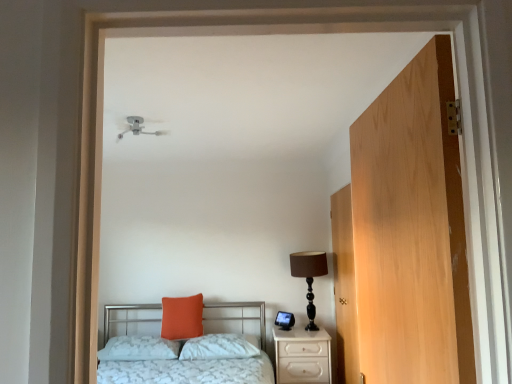
At what (x,y) coordinates should I click in order to perform the action: click on orange matte pillow at center, which is the first pillow in right-to-left order. Please return your answer as a coordinate pair (x, y). Looking at the image, I should click on (219, 347).

What is the approximate height of orange matte pillow at center, the first pillow when ordered from left to right?

orange matte pillow at center, the first pillow when ordered from left to right, is 6.80 inches tall.

You are a GUI agent. You are given a task and a screenshot of the screen. Output one action in this format:
    pyautogui.click(x=<x>, y=<y>)
    Task: Click on the orange matte pillow at center, the first pillow when ordered from left to right
    Image resolution: width=512 pixels, height=384 pixels.
    Given the screenshot: What is the action you would take?
    pyautogui.click(x=139, y=348)

What is the approximate height of brown fabric lampshade at right?

It is 28.44 inches.

Measure the distance between point (339, 228) and camera.

Point (339, 228) is 3.70 meters away from camera.

Where is `light wood door at right, which appears as the second door when viewed from the back`? light wood door at right, which appears as the second door when viewed from the back is located at coordinates (411, 230).

The height and width of the screenshot is (384, 512). Identify the location of orange fabric pillow at center, the second pillow from the left. (182, 317).

Based on the photo, is the position of orange matte pillow at center, the first pillow when ordered from left to right, less distant than that of white glossy nightstand at lower right?

No, orange matte pillow at center, the first pillow when ordered from left to right, is behind white glossy nightstand at lower right.

From the picture: Which is correct: orange matte pillow at center, the first pillow when ordered from left to right, is inside white glossy nightstand at lower right, or outside of it?

orange matte pillow at center, the first pillow when ordered from left to right, is not inside white glossy nightstand at lower right, it's outside.

Between point (123, 339) and point (293, 338), which one is positioned in front?

Positioned in front is point (293, 338).

From the picture: Can you confirm if light wood door at right, which appears as the second door when viewed from the back, is taller than orange matte pillow at center, positioned as the third pillow in left-to-right order?

Yes, light wood door at right, which appears as the second door when viewed from the back, is taller than orange matte pillow at center, positioned as the third pillow in left-to-right order.

From the image's perspective, which object appears higher, light wood door at right, which appears as the second door when viewed from the back, or orange matte pillow at center, which is the first pillow in right-to-left order?

light wood door at right, which appears as the second door when viewed from the back.

Is light wood door at right, the first door in the front-to-back sequence, in front of or behind orange matte pillow at center, positioned as the third pillow in left-to-right order, in the image?

light wood door at right, the first door in the front-to-back sequence, is positioned closer to the viewer than orange matte pillow at center, positioned as the third pillow in left-to-right order.

Is point (208, 339) closer or farther from the camera than point (437, 109)?

Point (208, 339) is farther from the camera than point (437, 109).

Is orange matte pillow at center, positioned as the third pillow in left-to-right order, oriented towards light wood door at right, marked as the 1th door in a left-to-right arrangement?

No, orange matte pillow at center, positioned as the third pillow in left-to-right order, is not oriented towards light wood door at right, marked as the 1th door in a left-to-right arrangement.

This screenshot has width=512, height=384. In order to click on the 1st pillow to the left when counting from the light wood door at right, the first door in the front-to-back sequence in this screenshot , I will do `click(219, 347)`.

Which object is positioned more to the right, orange matte pillow at center, which is the first pillow in right-to-left order, or light wood door at right, which appears as the second door when viewed from the back?

light wood door at right, which appears as the second door when viewed from the back.

Can you confirm if orange matte pillow at center, which is the first pillow in right-to-left order, is bigger than metallic silver bed at center?

No, orange matte pillow at center, which is the first pillow in right-to-left order, is not bigger than metallic silver bed at center.

Considering the positions of point (252, 355) and point (206, 379), is point (252, 355) closer or farther from the camera than point (206, 379)?

Point (252, 355).

Consider the image. What's the angular difference between orange matte pillow at center, positioned as the third pillow in left-to-right order, and metallic silver bed at center's facing directions?

They differ by 0.812 degrees in their facing directions.

Is orange matte pillow at center, positioned as the third pillow in left-to-right order, not near metallic silver bed at center?

No, there isn't a large distance between orange matte pillow at center, positioned as the third pillow in left-to-right order, and metallic silver bed at center.

In the image, there is a orange matte pillow at center, which is the first pillow in right-to-left order. At what (x,y) coordinates should I click in order to perform the action: click on nightstand below it (from a real-world perspective). Please return your answer as a coordinate pair (x, y). The image size is (512, 384). Looking at the image, I should click on (302, 356).

Considering the positions of objects orange matte pillow at center, positioned as the third pillow in left-to-right order, and white glossy nightstand at lower right in the image provided, who is behind, orange matte pillow at center, positioned as the third pillow in left-to-right order, or white glossy nightstand at lower right?

Positioned behind is orange matte pillow at center, positioned as the third pillow in left-to-right order.

Which object is positioned more to the right, orange matte pillow at center, which is the first pillow in right-to-left order, or white glossy nightstand at lower right?

From the viewer's perspective, white glossy nightstand at lower right appears more on the right side.

Would you say orange matte pillow at center, which is the first pillow in right-to-left order, contains white glossy nightstand at lower right?

Actually, white glossy nightstand at lower right is outside orange matte pillow at center, which is the first pillow in right-to-left order.

Does brown fabric lampshade at right touch metallic silver bed at center?

brown fabric lampshade at right and metallic silver bed at center are clearly separated.

Does brown fabric lampshade at right have a smaller size compared to metallic silver bed at center?

Correct, brown fabric lampshade at right occupies less space than metallic silver bed at center.

Does point (310, 314) appear closer or farther from the camera than point (267, 368)?

Clearly, point (310, 314) is more distant from the camera than point (267, 368).

From the image's perspective, who appears lower, brown fabric lampshade at right or metallic silver bed at center?

metallic silver bed at center.

Where is `table lamp that is behind the orange matte pillow at center, the first pillow when ordered from left to right`? The width and height of the screenshot is (512, 384). table lamp that is behind the orange matte pillow at center, the first pillow when ordered from left to right is located at coordinates (309, 277).

From a real-world perspective, who is located lower, orange matte pillow at center, the 3th pillow viewed from the right, or brown fabric lampshade at right?

orange matte pillow at center, the 3th pillow viewed from the right, from a real-world perspective.

Can we say orange matte pillow at center, the 3th pillow viewed from the right, lies outside brown fabric lampshade at right?

Yes.

In the image, is orange matte pillow at center, the 3th pillow viewed from the right, positioned in front of or behind brown fabric lampshade at right?

orange matte pillow at center, the 3th pillow viewed from the right, is positioned closer to the viewer than brown fabric lampshade at right.

Which pillow is the 3rd one when counting from the left side of the white glossy nightstand at lower right? Please provide its 2D coordinates.

[(139, 348)]

The image size is (512, 384). What are the coordinates of `the 2nd door directly above the orange matte pillow at center, which is the first pillow in right-to-left order (from a real-world perspective)` in the screenshot? It's located at (411, 230).

In the scene shown: Based on their spatial positions, is white glossy nightstand at lower right or orange fabric pillow at center, which is the second pillow in right-to-left order, closer to orange matte pillow at center, the 3th pillow viewed from the right?

Based on the image, orange fabric pillow at center, which is the second pillow in right-to-left order, appears to be nearer to orange matte pillow at center, the 3th pillow viewed from the right.

Estimate the real-world distances between objects in this image. Which object is closer to light wood door at right, the first door in the front-to-back sequence, orange matte pillow at center, the first pillow when ordered from left to right, or light brown wood door at right, the 2th door viewed from the left?

light brown wood door at right, the 2th door viewed from the left.

Looking at the image, which one is located further to brown fabric lampshade at right, metallic silver bed at center or light wood door at right, which appears as the 2th door when viewed from the right?

light wood door at right, which appears as the 2th door when viewed from the right.

Which object lies further to the anchor point orange matte pillow at center, positioned as the third pillow in left-to-right order, orange matte pillow at center, the first pillow when ordered from left to right, or light wood door at right, which appears as the second door when viewed from the back?

The object further to orange matte pillow at center, positioned as the third pillow in left-to-right order, is light wood door at right, which appears as the second door when viewed from the back.

Considering their positions, is orange matte pillow at center, positioned as the third pillow in left-to-right order, positioned further to light wood door at right, the first door in the front-to-back sequence, than light brown wood door at right, the 1th door positioned from the back?

The object further to light wood door at right, the first door in the front-to-back sequence, is orange matte pillow at center, positioned as the third pillow in left-to-right order.

Which object lies nearer to the anchor point light brown wood door at right, placed as the 1th door when sorted from right to left, light wood door at right, marked as the 1th door in a left-to-right arrangement, or white glossy nightstand at lower right?

The object closer to light brown wood door at right, placed as the 1th door when sorted from right to left, is white glossy nightstand at lower right.

Based on the photo, based on their spatial positions, is brown fabric lampshade at right or orange fabric pillow at center, the second pillow from the left, closer to light wood door at right, which appears as the 2th door when viewed from the right?

brown fabric lampshade at right is closer to light wood door at right, which appears as the 2th door when viewed from the right.

Based on their spatial positions, is brown fabric lampshade at right or metallic silver bed at center closer to orange fabric pillow at center, the second pillow from the left?

metallic silver bed at center is positioned closer to the anchor orange fabric pillow at center, the second pillow from the left.

The width and height of the screenshot is (512, 384). Find the location of `nightstand positioned between light wood door at right, marked as the 1th door in a left-to-right arrangement, and orange matte pillow at center, the 3th pillow viewed from the right, from near to far`. nightstand positioned between light wood door at right, marked as the 1th door in a left-to-right arrangement, and orange matte pillow at center, the 3th pillow viewed from the right, from near to far is located at coordinates (302, 356).

Identify the location of nightstand located between orange matte pillow at center, the first pillow when ordered from left to right, and brown fabric lampshade at right in the left-right direction. This screenshot has height=384, width=512. (302, 356).

Image resolution: width=512 pixels, height=384 pixels. In order to click on nightstand between orange matte pillow at center, positioned as the third pillow in left-to-right order, and light brown wood door at right, positioned as the 2th door in front-to-back order, in the horizontal direction in this screenshot , I will do [x=302, y=356].

Locate an element on the screen. This screenshot has height=384, width=512. bed between light wood door at right, the first door in the front-to-back sequence, and white glossy nightstand at lower right, along the z-axis is located at coordinates (198, 360).